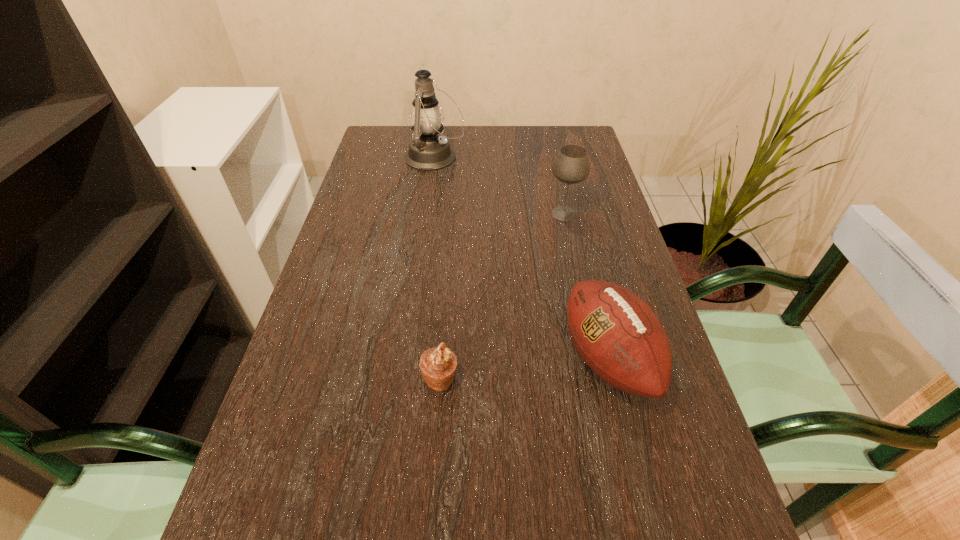
Where is `the farthest object`? the farthest object is located at coordinates (428, 151).

Where is `the tallest object`? the tallest object is located at coordinates pos(428,151).

You are a GUI agent. You are given a task and a screenshot of the screen. Output one action in this format:
    pyautogui.click(x=<x>, y=<y>)
    Task: Click on the third shortest object
    
    Given the screenshot: What is the action you would take?
    pyautogui.click(x=571, y=166)

Identify the location of wineglass. This screenshot has height=540, width=960. (571, 166).

The width and height of the screenshot is (960, 540). Identify the location of the third tallest object. (614, 331).

Where is `the shortest object`? The image size is (960, 540). the shortest object is located at coordinates (438, 365).

Where is `free space located on the right of the tallest object`? The image size is (960, 540). free space located on the right of the tallest object is located at coordinates (565, 158).

The height and width of the screenshot is (540, 960). I want to click on free location located 0.170m on the left of the second farthest object, so click(x=483, y=213).

Locate an element on the screen. vacant space located 0.170m on the front of the second shortest object is located at coordinates (649, 528).

Locate an element on the screen. blank space located 0.350m on the back of the muffin is located at coordinates (450, 245).